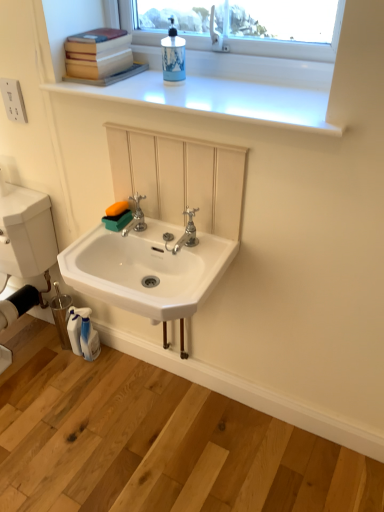
Question: Does blue ceramic soap dispenser at upper center appear on the left side of white plastic electrical outlet at upper left?

Choices:
 (A) yes
 (B) no

Answer: (B)

Question: Is the depth of blue ceramic soap dispenser at upper center greater than that of white plastic electrical outlet at upper left?

Choices:
 (A) no
 (B) yes

Answer: (A)

Question: Considering the relative sizes of blue ceramic soap dispenser at upper center and white plastic electrical outlet at upper left in the image provided, is blue ceramic soap dispenser at upper center shorter than white plastic electrical outlet at upper left?

Choices:
 (A) yes
 (B) no

Answer: (B)

Question: Would you say blue ceramic soap dispenser at upper center is outside white plastic electrical outlet at upper left?

Choices:
 (A) no
 (B) yes

Answer: (B)

Question: Is blue ceramic soap dispenser at upper center in front of white plastic electrical outlet at upper left?

Choices:
 (A) no
 (B) yes

Answer: (B)

Question: From the image's perspective, is white glossy sink at center located above or below blue ceramic soap dispenser at upper center?

Choices:
 (A) above
 (B) below

Answer: (B)

Question: Is point (170, 227) positioned closer to the camera than point (170, 20)?

Choices:
 (A) closer
 (B) farther

Answer: (A)

Question: In the image, is white glossy sink at center positioned in front of or behind blue ceramic soap dispenser at upper center?

Choices:
 (A) behind
 (B) front

Answer: (B)

Question: Which is correct: white glossy sink at center is inside blue ceramic soap dispenser at upper center, or outside of it?

Choices:
 (A) outside
 (B) inside

Answer: (A)

Question: Is polished chrome faucet at center, positioned as the 2th tap in left-to-right order, situated inside white glossy sink at center or outside?

Choices:
 (A) outside
 (B) inside

Answer: (A)

Question: In the image, is polished chrome faucet at center, positioned as the 1th tap in right-to-left order, positioned in front of or behind white glossy sink at center?

Choices:
 (A) behind
 (B) front

Answer: (A)

Question: In terms of size, does polished chrome faucet at center, positioned as the 2th tap in left-to-right order, appear bigger or smaller than white glossy sink at center?

Choices:
 (A) small
 (B) big

Answer: (A)

Question: In terms of height, does polished chrome faucet at center, positioned as the 1th tap in right-to-left order, look taller or shorter compared to white glossy sink at center?

Choices:
 (A) short
 (B) tall

Answer: (A)

Question: In terms of width, does white glossy sink at lower center look wider or thinner when compared to silver metallic faucet at center, marked as the 1th tap in a left-to-right arrangement?

Choices:
 (A) wide
 (B) thin

Answer: (A)

Question: From a real-world perspective, is white glossy sink at lower center positioned above or below silver metallic faucet at center, marked as the 1th tap in a left-to-right arrangement?

Choices:
 (A) below
 (B) above

Answer: (A)